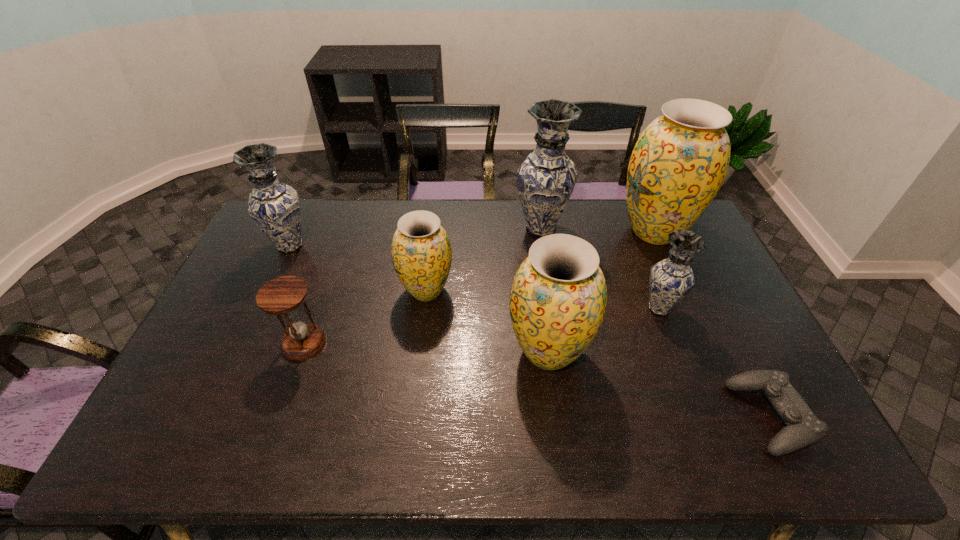
Find the location of a particular element. The image size is (960, 540). vacant position located 0.280m on the front of the rightmost blue vase is located at coordinates (698, 411).

I want to click on free point located on the front of the hourglass, so click(279, 415).

Find the location of a particular element. The image size is (960, 540). vacant point located on the left of the gray control is located at coordinates 696,417.

Image resolution: width=960 pixels, height=540 pixels. I want to click on object present at the near edge, so click(x=803, y=428).

Where is `object located at the left edge`? object located at the left edge is located at coordinates (274, 206).

Identify the location of vase located at the right edge. This screenshot has height=540, width=960. (680, 160).

Where is `control at the right edge`? control at the right edge is located at coordinates (803, 428).

The width and height of the screenshot is (960, 540). Find the location of `object at the far left corner`. object at the far left corner is located at coordinates (274, 206).

In order to click on object located in the far right corner section of the desktop in this screenshot , I will do `click(680, 160)`.

Where is `object positioned at the near right corner`? The width and height of the screenshot is (960, 540). object positioned at the near right corner is located at coordinates (803, 428).